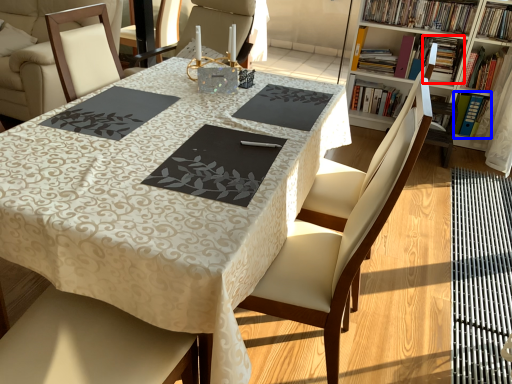
Question: Which object is further to the camera taking this photo, book (highlighted by a red box) or book (highlighted by a blue box)?

Choices:
 (A) book
 (B) book

Answer: (A)